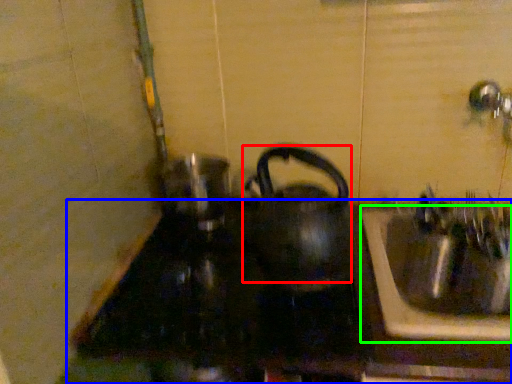
Question: Which object is the closest to the kettle (highlighted by a red box)? Choose among these: counter top (highlighted by a blue box) or sink (highlighted by a green box).

Choices:
 (A) counter top
 (B) sink

Answer: (A)